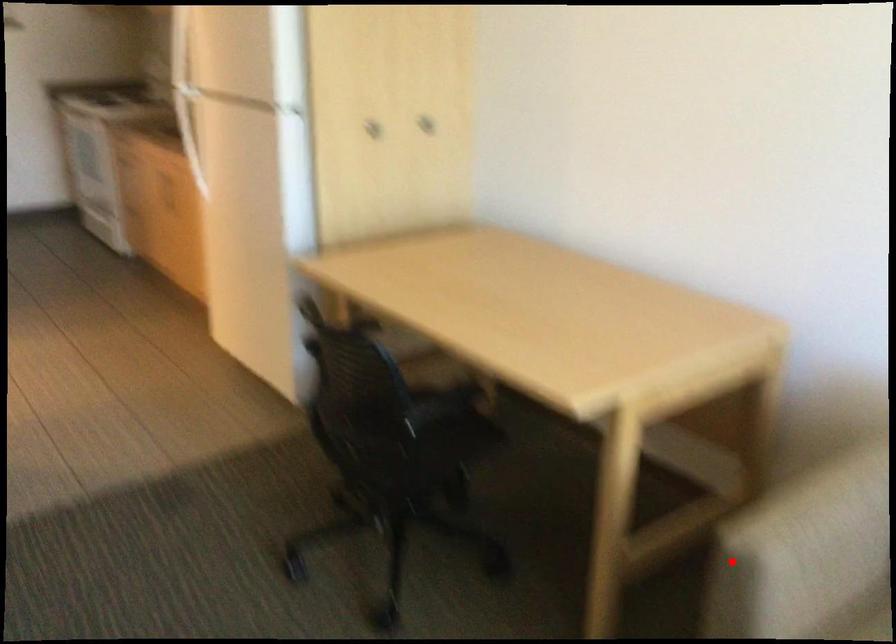
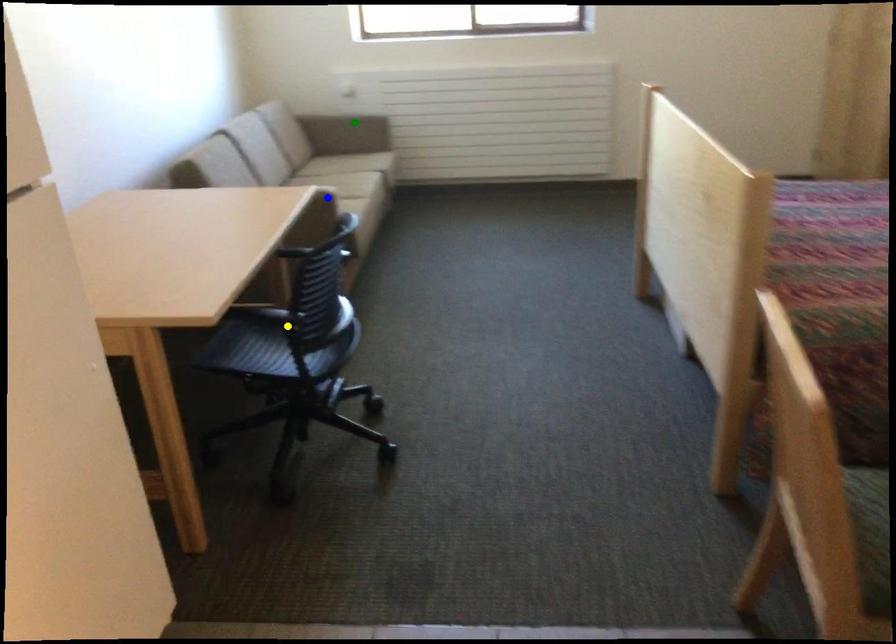
Question: I am providing you with two images of the same scene from different viewpoints. A red point is marked on the first image. You are given multiple points on the second image. Which point in image 2 represents the same 3d spot as the red point in image 1?

Choices:
 (A) green point
 (B) yellow point
 (C) blue point

Answer: (C)